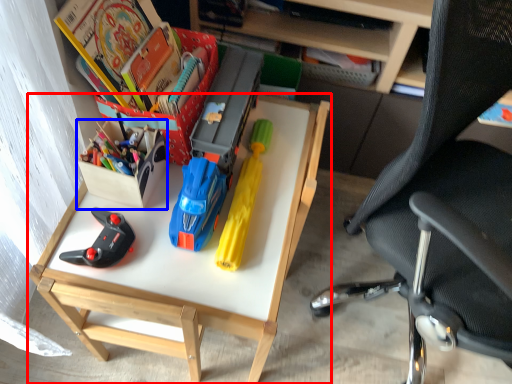
Question: Among these objects, which one is nearest to the camera, desk (highlighted by a red box) or kit (highlighted by a blue box)?

Choices:
 (A) desk
 (B) kit

Answer: (A)